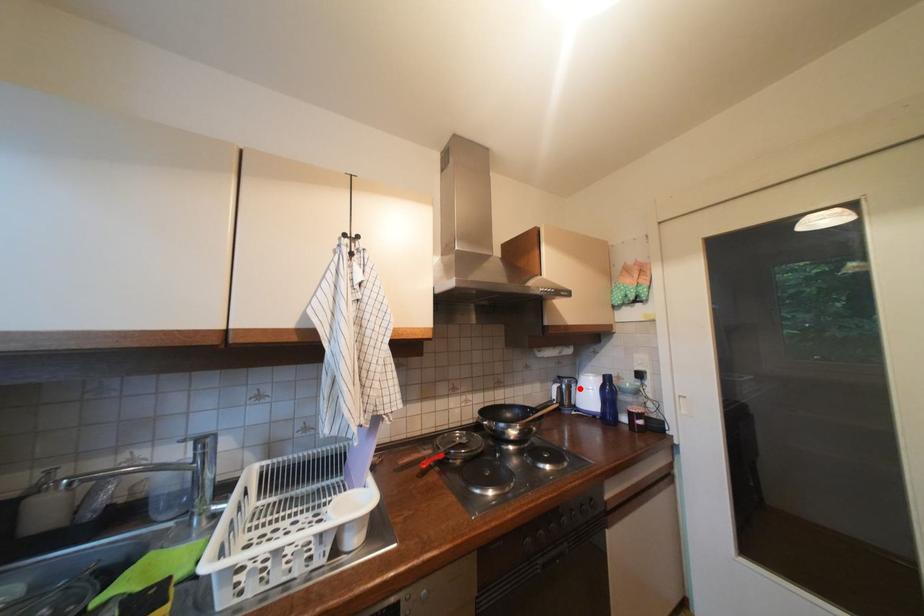
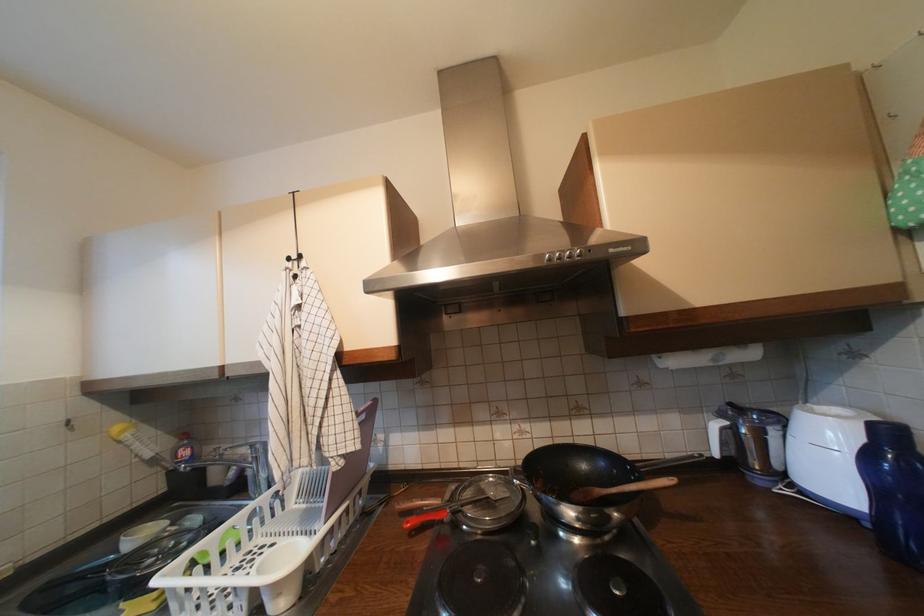
Locate, in the second image, the point that corresponds to the highlighted location in the first image.

(774, 435)